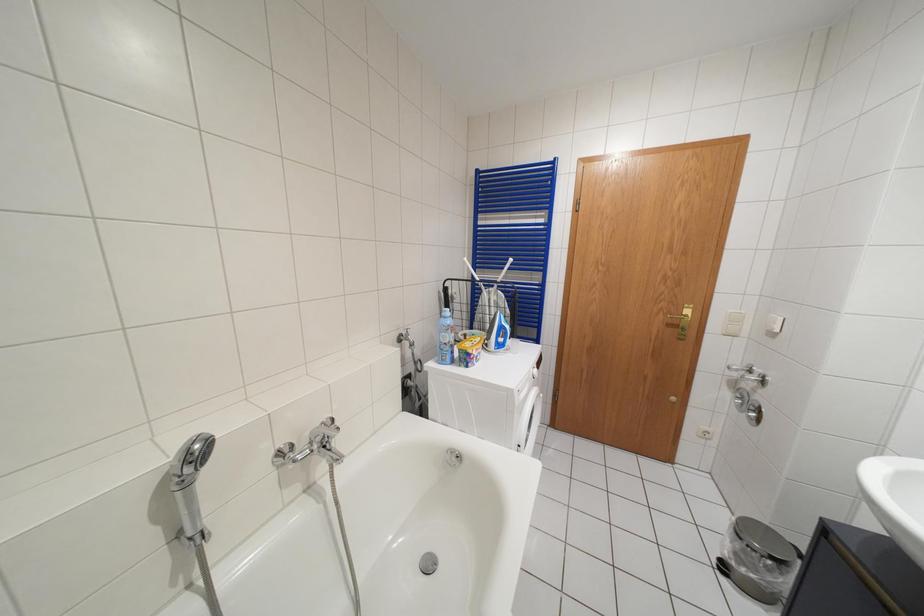
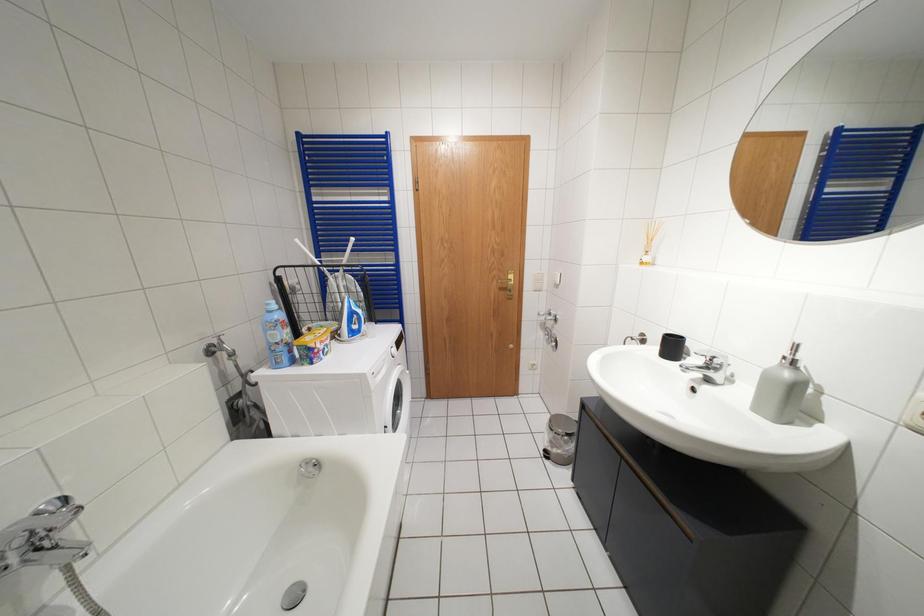
Question: The camera is either moving clockwise (left) or counter-clockwise (right) around the object. The first image is from the beginning of the video and the second image is from the end. Is the camera moving left or right when shooting the video?

Choices:
 (A) Left
 (B) Right

Answer: (A)